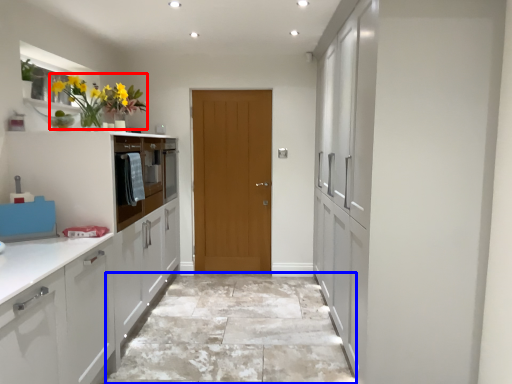
Question: Among these objects, which one is nearest to the camera, floral arrangement (highlighted by a red box) or granite (highlighted by a blue box)?

Choices:
 (A) floral arrangement
 (B) granite

Answer: (A)